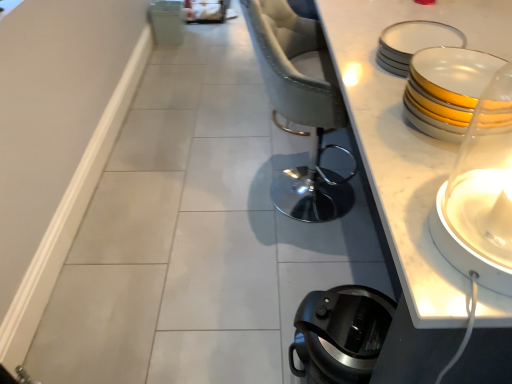
At what (x,y) coordinates should I click in order to perform the action: click on free location in front of sleek gray fabric chair at center. Please return your answer as a coordinate pair (x, y). Looking at the image, I should click on (300, 251).